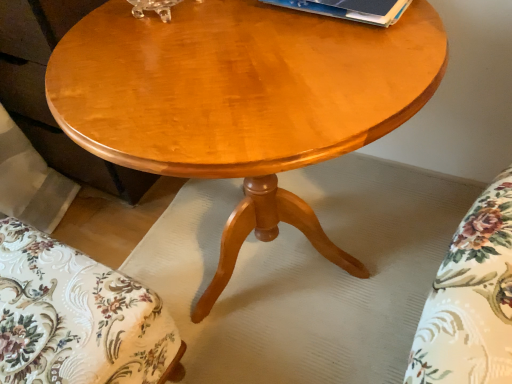
In order to click on vacant area in front of blue paper at upper center in this screenshot , I will do `click(331, 56)`.